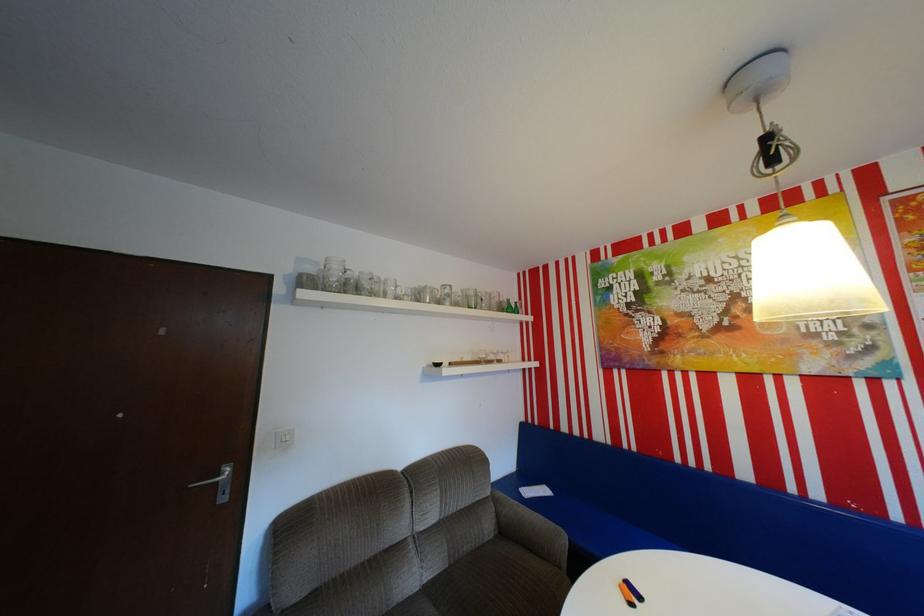
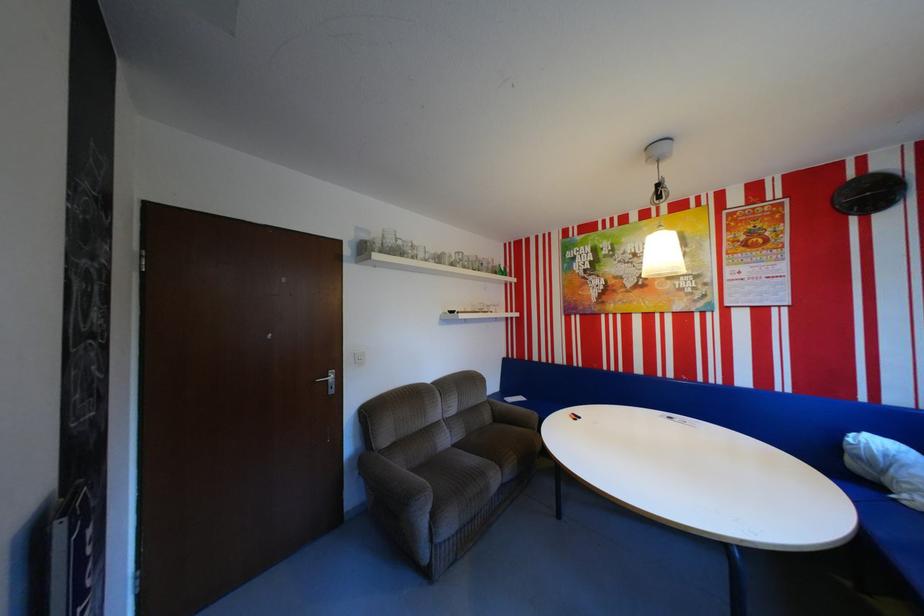
Question: The camera is either moving clockwise (left) or counter-clockwise (right) around the object. The first image is from the beginning of the video and the second image is from the end. Is the camera moving left or right when shooting the video?

Choices:
 (A) Left
 (B) Right

Answer: (A)